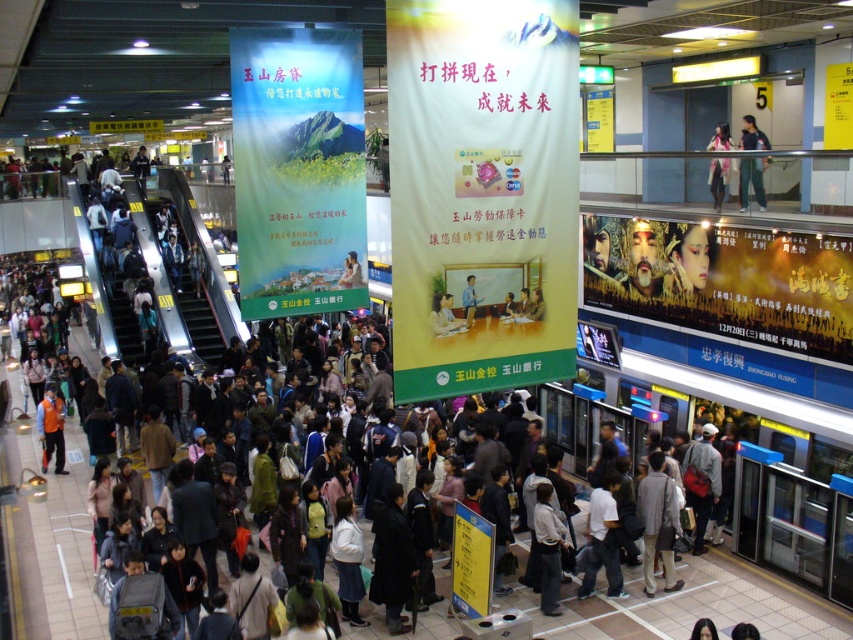
You are a photographer standing in the train station. You notice the matte black poster at right and the green fabric pants at upper right. Which object is positioned lower in the scene?

The matte black poster at right is positioned below the green fabric pants at upper right, so it is lower in the scene.

You are standing in the train station and see two points marked on the floor. The first point is at coordinate point(781,323) and the second point is at point(189,292). If you want to walk from the first point to the second point, will you have to go through the area in front of the second point?

Yes, because point(781,323) is in front of point(189,292), so walking from the first to the second point requires passing through the area in front of the second point.

You are a photographer trying to capture both the metallic silver escalator at left and the green fabric pants at upper right in a single frame. Given their sizes, which object will appear bigger in your photo?

The metallic silver escalator at left will appear bigger in the photo because it is larger in size than the green fabric pants at upper right.